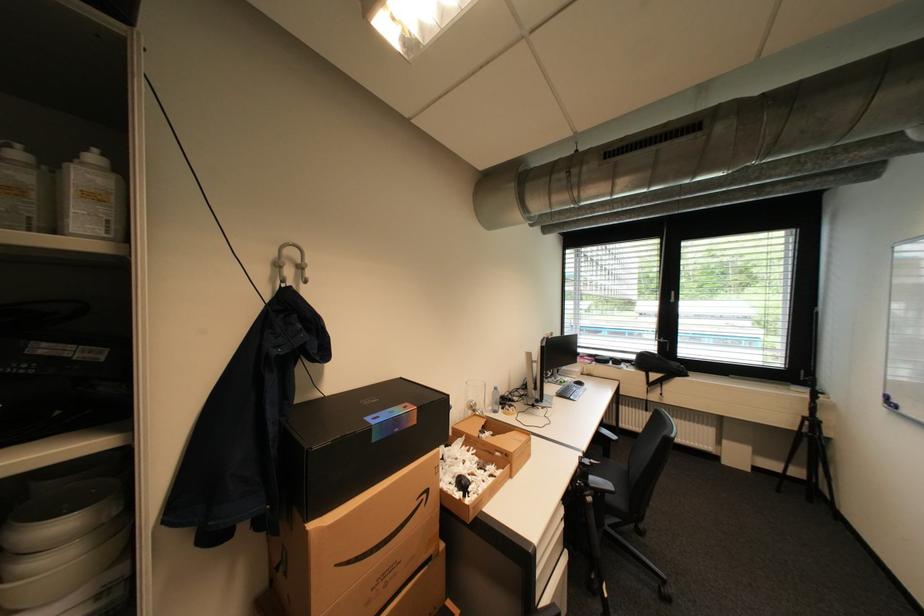
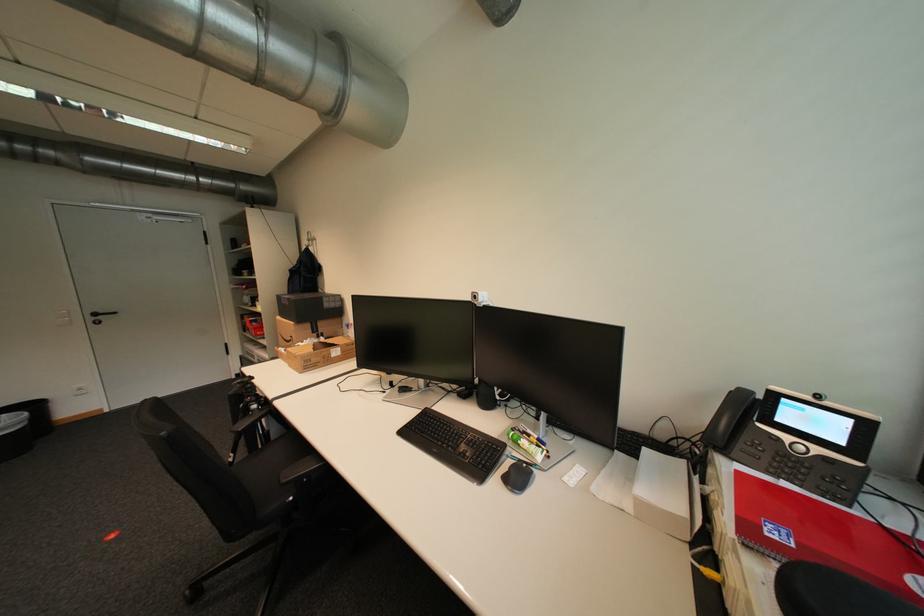
Find the pixel in the second image that matches point (424, 424) in the first image.

(296, 305)